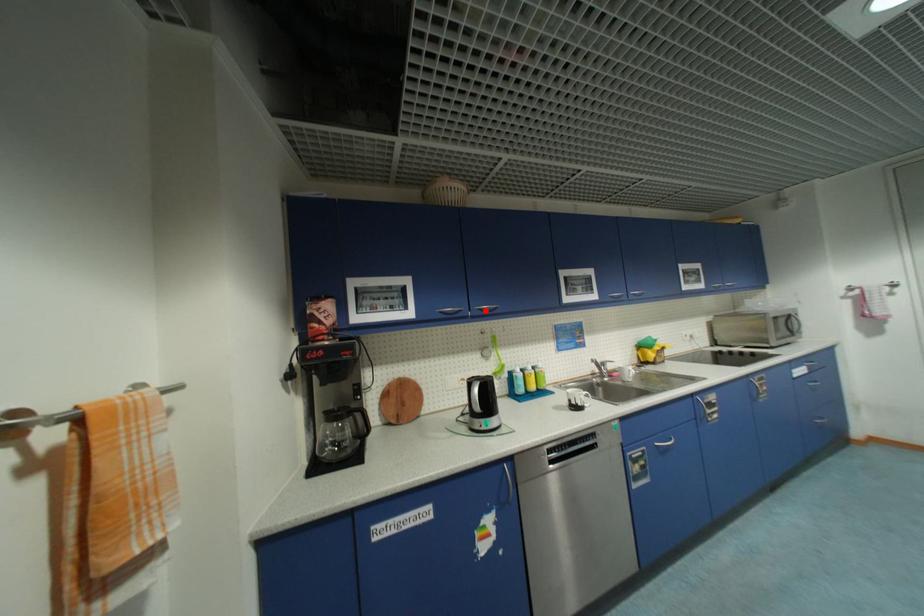
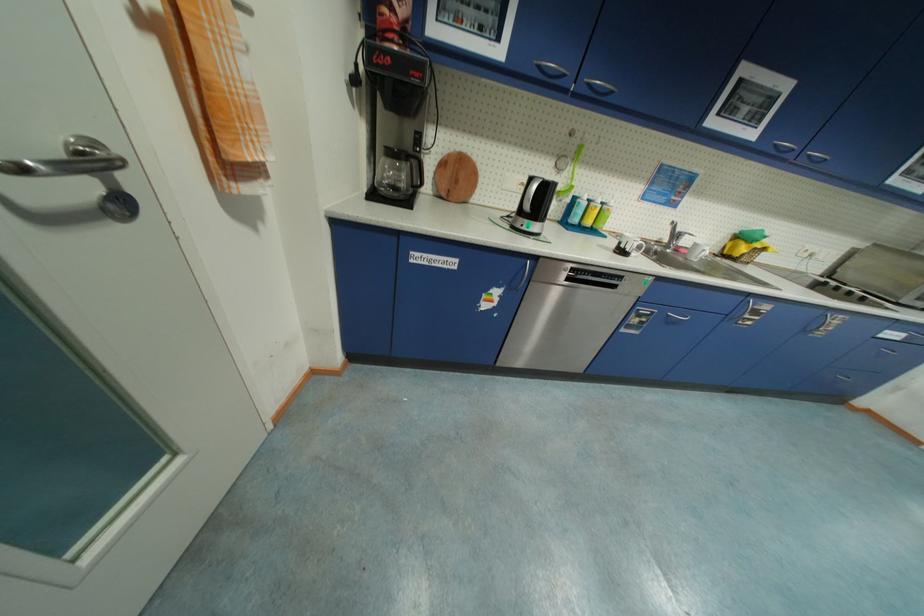
Where in the second image is the point corresponding to the highlighted location from the first image?

(594, 86)